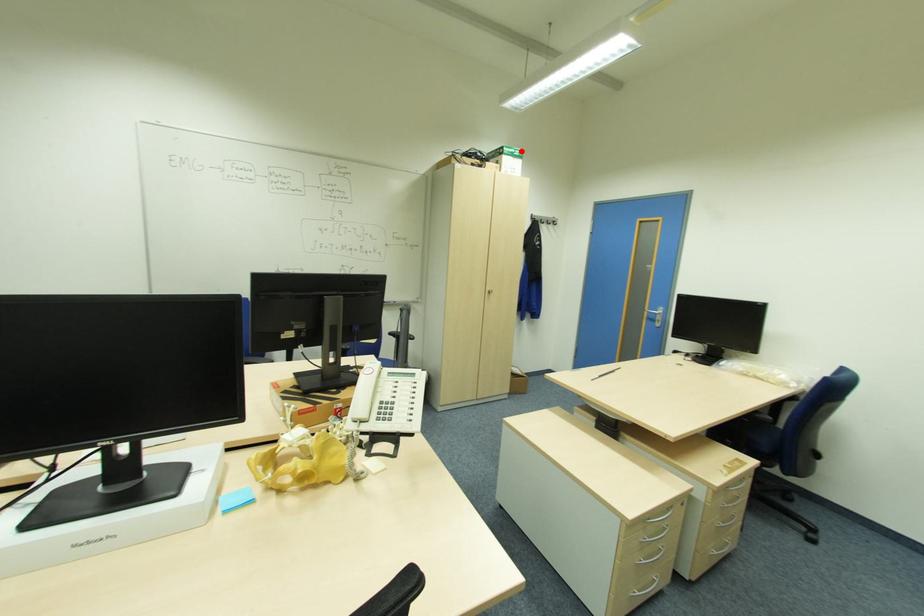
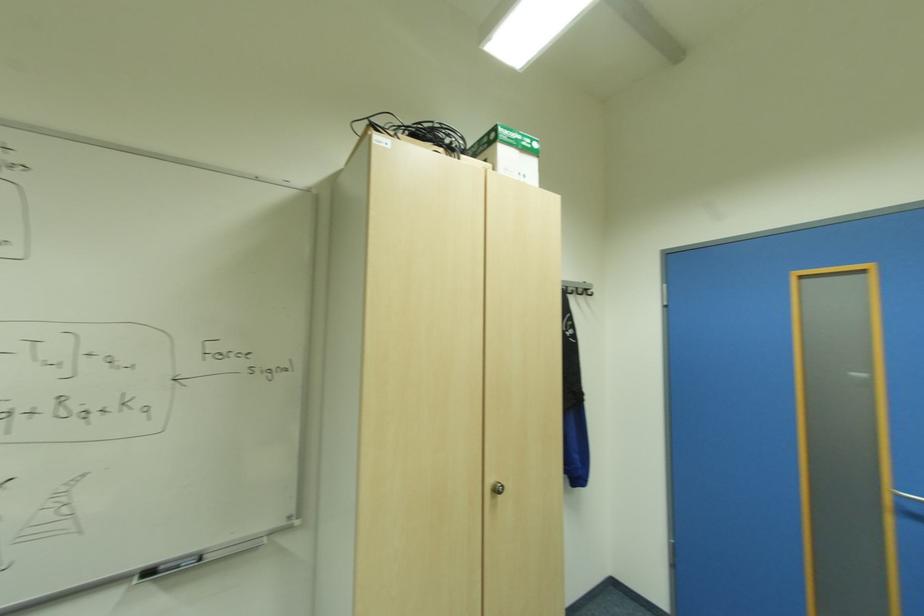
Locate, in the second image, the point that corresponds to the highlighted location in the first image.

(533, 140)